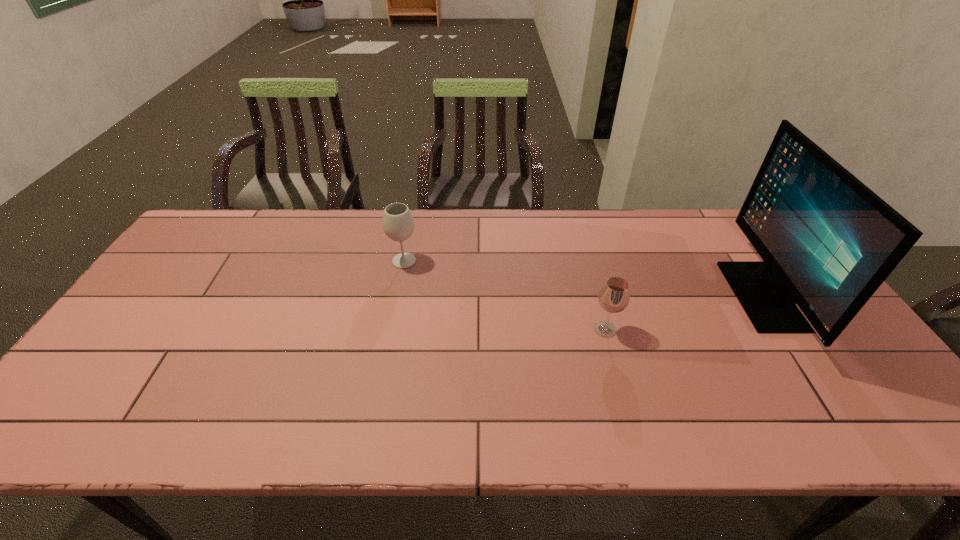
At what (x,y) coordinates should I click in order to perform the action: click on vacant region located 0.320m on the back of the shorter wineglass. Please return your answer as a coordinate pair (x, y). Looking at the image, I should click on (582, 244).

Where is `monitor that is at the far edge`? This screenshot has height=540, width=960. monitor that is at the far edge is located at coordinates (828, 242).

Where is `wineglass situated at the far edge`? The image size is (960, 540). wineglass situated at the far edge is located at coordinates coord(398,224).

Image resolution: width=960 pixels, height=540 pixels. In order to click on object that is at the right edge in this screenshot , I will do `click(828, 242)`.

Find the location of a particular element. object located in the far right corner section of the desktop is located at coordinates (828, 242).

This screenshot has width=960, height=540. In order to click on blank space at the far edge of the desktop in this screenshot , I will do point(639,212).

Locate an element on the screen. This screenshot has width=960, height=540. free space at the near edge of the desktop is located at coordinates (676, 420).

Where is `vacant space at the left edge`? The height and width of the screenshot is (540, 960). vacant space at the left edge is located at coordinates (181, 260).

What are the coordinates of `vacant area at the right edge of the desktop` in the screenshot? It's located at (883, 397).

Image resolution: width=960 pixels, height=540 pixels. Find the location of `blank space at the far left corner`. blank space at the far left corner is located at coordinates (231, 251).